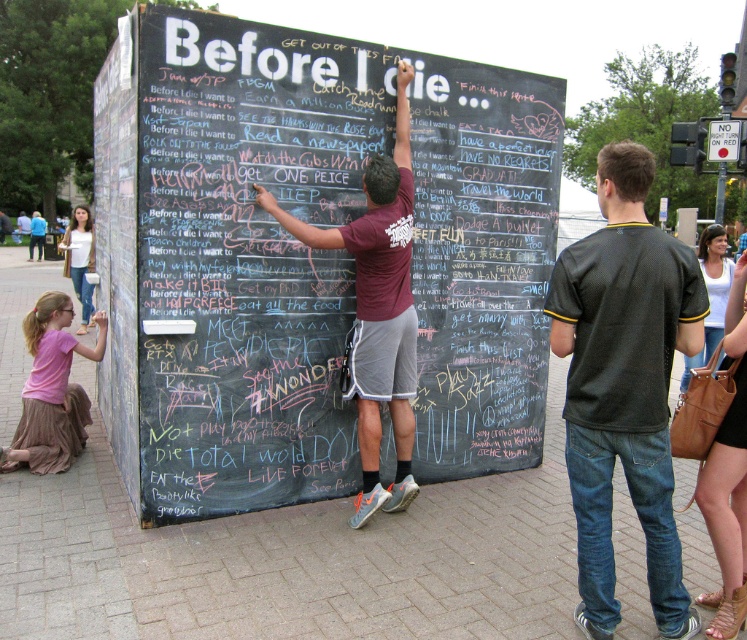
Question: From the image, what is the correct spatial relationship of dark gray t-shirt at center in relation to brown leather purse at lower right?

Choices:
 (A) left
 (B) right

Answer: (A)

Question: Is black chalkboard at center thinner than maroon t-shirt at center?

Choices:
 (A) no
 (B) yes

Answer: (A)

Question: Which point is closer to the camera?

Choices:
 (A) (557, 289)
 (B) (332, 157)

Answer: (A)

Question: Among these points, which one is farthest from the camera?

Choices:
 (A) (740, 467)
 (B) (368, 385)

Answer: (B)

Question: Does dark gray t-shirt at center appear on the right side of maroon t-shirt at center?

Choices:
 (A) no
 (B) yes

Answer: (B)

Question: Among these points, which one is nearest to the camera?

Choices:
 (A) (686, 264)
 (B) (34, 460)
 (C) (471, 349)
 (D) (365, 506)

Answer: (A)